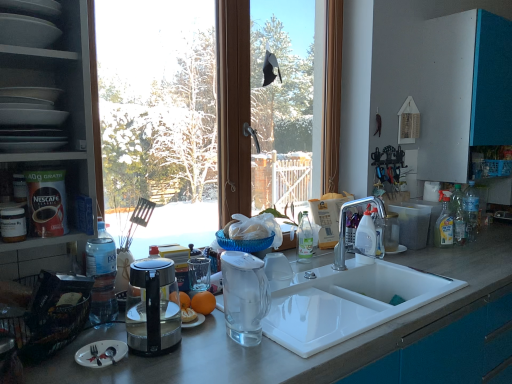
Question: In terms of size, does silver matte fork at lower left appear bigger or smaller than matte gray plates at upper left, arranged as the 2th shelf when ordered from the bottom?

Choices:
 (A) big
 (B) small

Answer: (B)

Question: Considering the positions of silver matte fork at lower left and matte gray plates at upper left, which is the 1th shelf from top to bottom, in the image, is silver matte fork at lower left wider or thinner than matte gray plates at upper left, which is the 1th shelf from top to bottom,?

Choices:
 (A) wide
 (B) thin

Answer: (A)

Question: Considering the real-world distances, which object is closest to the silver metallic faucet at sink right?

Choices:
 (A) matte white plates at left, positioned as the 1th shelf in bottom-to-top order
 (B) silver matte fork at lower left
 (C) yellow liquid bottle at right
 (D) transparent glass blender at sink
 (E) transparent glass window at center

Answer: (C)

Question: Which object is the closest to the orange matte at center?

Choices:
 (A) yellow liquid bottle at right
 (B) silver metallic faucet at sink right
 (C) smooth gray countertop at center
 (D) transparent glass window at center
 (E) transparent glass blender at sink

Answer: (E)